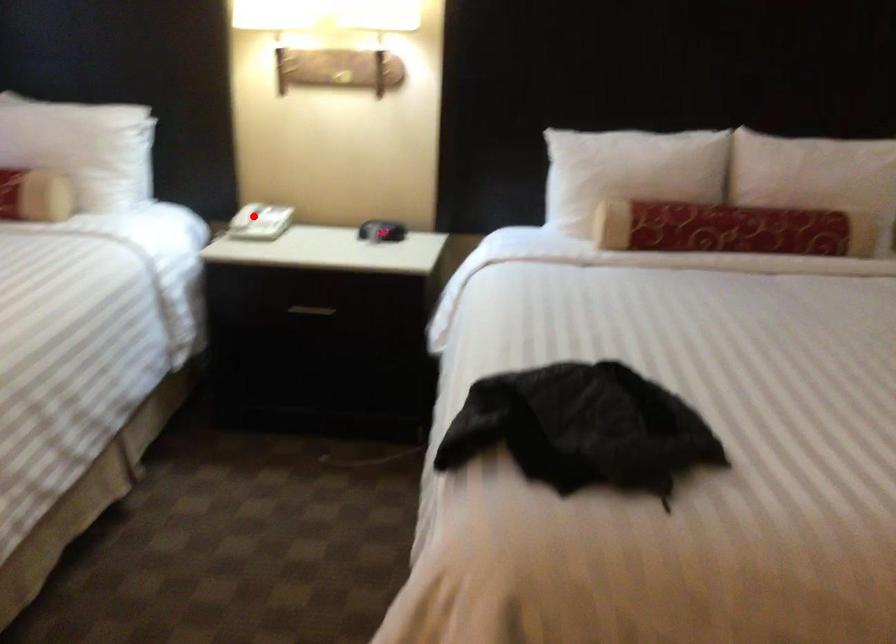
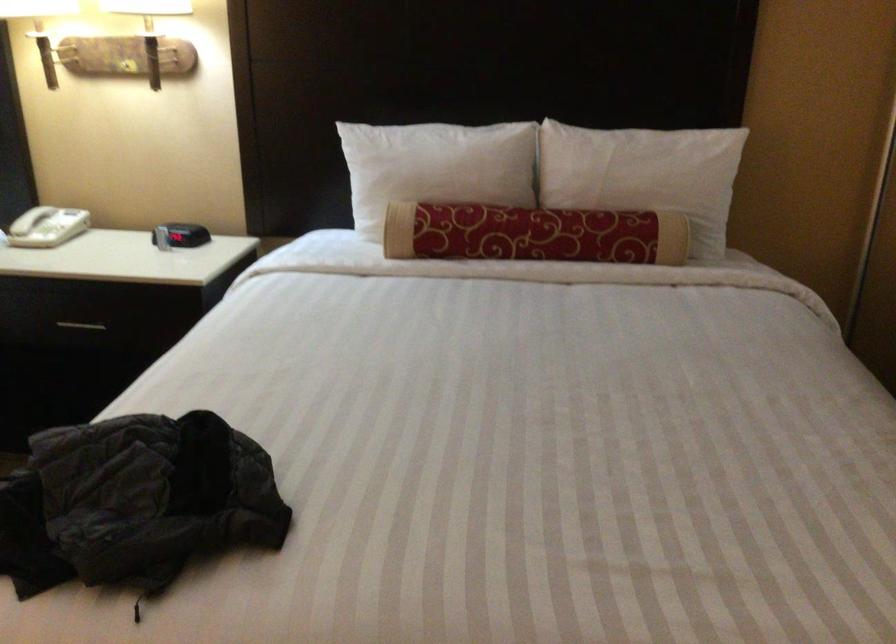
In the second image, find the point that corresponds to the highlighted location in the first image.

(30, 220)